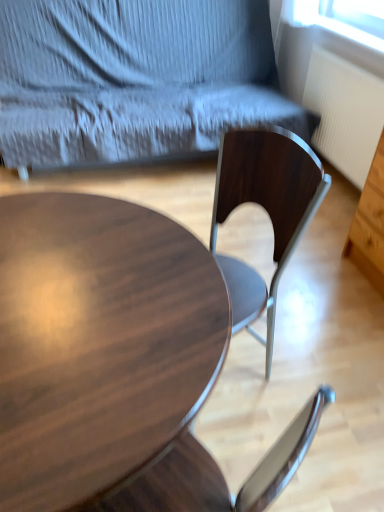
Find the location of `vacant space situated above shiny dark wood coffee table at center (from a real-world perspective)`. vacant space situated above shiny dark wood coffee table at center (from a real-world perspective) is located at coordinates (104, 298).